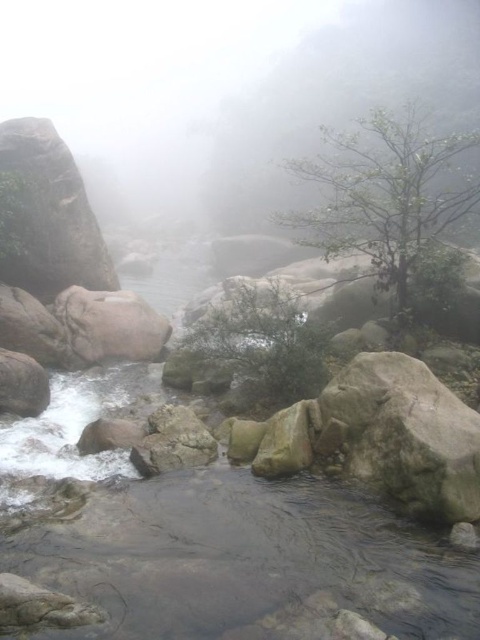
Question: Which object appears closest to the camera in this image?

Choices:
 (A) clear water at center
 (B) smooth granite boulder at left

Answer: (A)

Question: From the image, what is the correct spatial relationship of clear water at center in relation to smooth granite boulder at left?

Choices:
 (A) right
 (B) left

Answer: (A)

Question: Considering the relative positions of clear water at center and smooth granite boulder at left in the image provided, where is clear water at center located with respect to smooth granite boulder at left?

Choices:
 (A) right
 (B) left

Answer: (A)

Question: Is clear water at center bigger than smooth granite boulder at left?

Choices:
 (A) yes
 (B) no

Answer: (B)